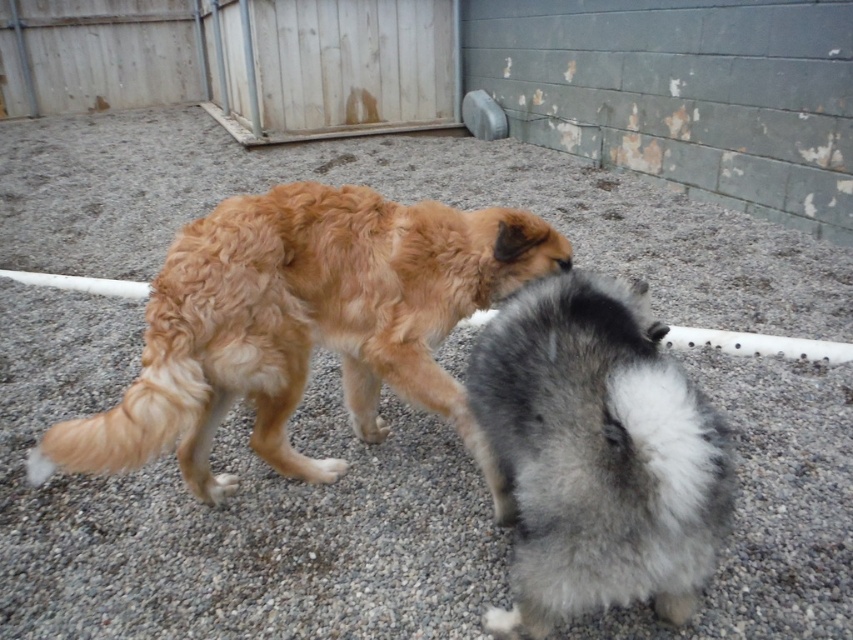
Question: Does golden fur dog at center have a greater width compared to fluffy gray fur at center?

Choices:
 (A) yes
 (B) no

Answer: (A)

Question: Considering the real-world distances, which object is closest to the white fluffy paw at center?

Choices:
 (A) golden fur dog at center
 (B) fluffy gray fur at center

Answer: (A)

Question: Does golden fur dog at center appear over white fluffy paw at center?

Choices:
 (A) no
 (B) yes

Answer: (B)

Question: Considering the relative positions of golden fur dog at center and white fluffy paw at center in the image provided, where is golden fur dog at center located with respect to white fluffy paw at center?

Choices:
 (A) right
 (B) left

Answer: (A)

Question: Estimate the real-world distances between objects in this image. Which object is farther from the white fluffy paw at center?

Choices:
 (A) golden fur dog at center
 (B) fluffy gray fur at center

Answer: (B)

Question: Among these objects, which one is nearest to the camera?

Choices:
 (A) golden fur dog at center
 (B) fluffy gray fur at center
 (C) white fluffy paw at center

Answer: (B)